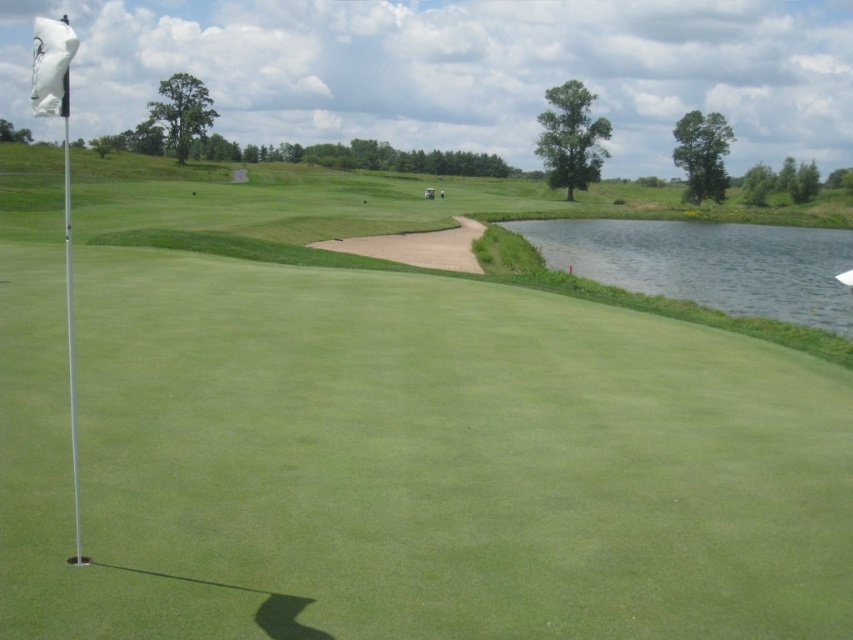
You are a golfer standing on the green and want to hit your ball towards the water. Which object, the clear water at right or the white matte flag at upper left, is closer to you?

The white matte flag at upper left is closer to you because it is nearer than the clear water at right, which is further away.

You are a golfer preparing to putt on the green. You notice the clear water at right and the white matte flag at upper left. Which object is closer to the ground?

The clear water at right is shorter than the white matte flag at upper left, so the clear water at right is closer to the ground.